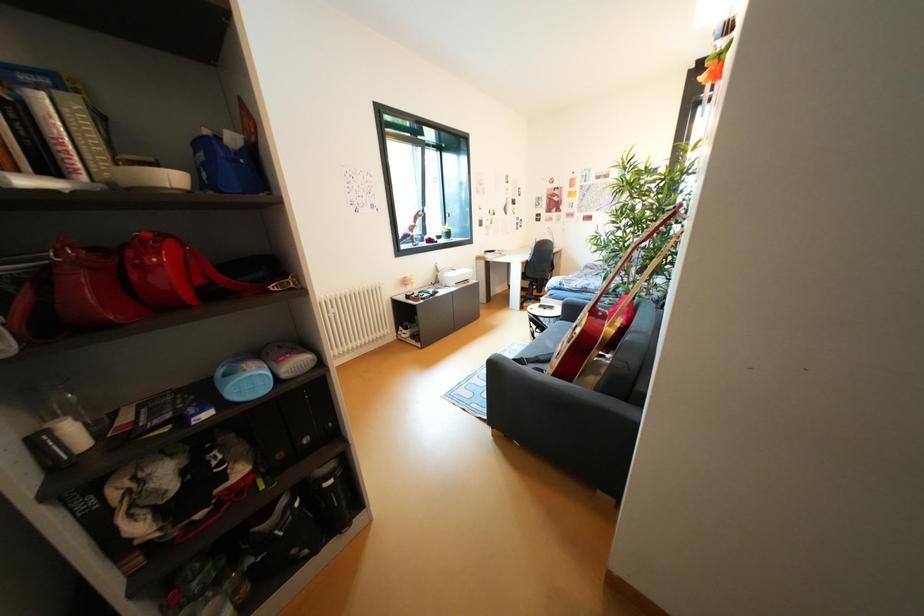
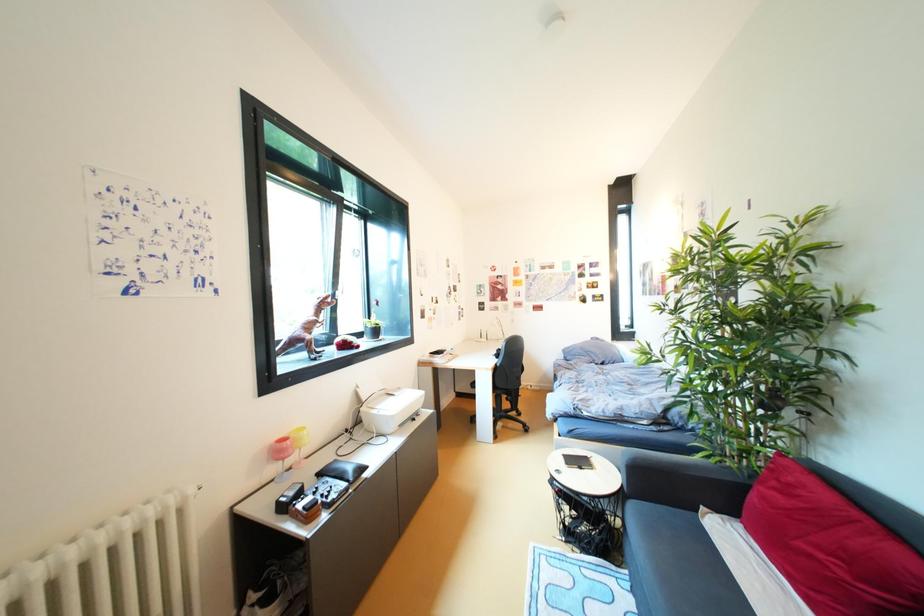
Question: What movement of the cameraman would produce the second image?

Choices:
 (A) Left
 (B) Right
 (C) Forward
 (D) Backward

Answer: (C)